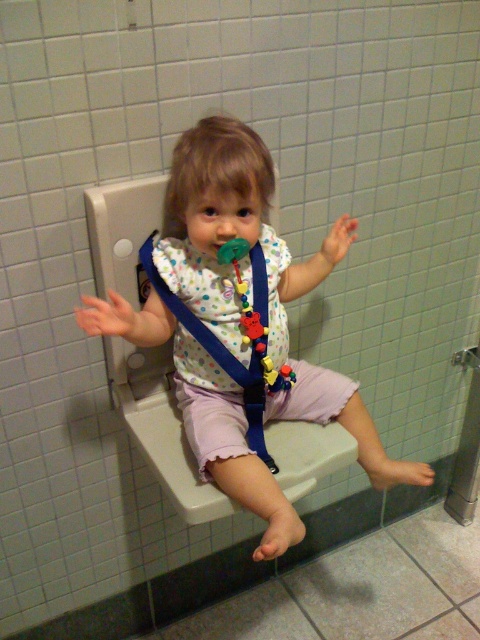
You are a parent trying to dress your child. You have a pastel polka dot shirt at center and a white dotted fabric bib at center. Which item should you put on first to ensure proper layering?

The pastel polka dot shirt at center is in front of the white dotted fabric bib at center, so you should put on the white dotted fabric bib at center first before the shirt to ensure proper layering.

You are a parent trying to dress your child. You have a pastel polka dot shirt at center and a white dotted fabric bib at center. Which clothing item should you put on first based on their sizes?

The pastel polka dot shirt at center is bigger than the white dotted fabric bib at center, so you should put on the pastel polka dot shirt at center first before the smaller bib.

Looking at the child in the image, which clothing item is positioned higher on their body between the pastel polka dot shirt at center and the white dotted fabric bib at center?

The pastel polka dot shirt at center is much taller than the white dotted fabric bib at center, so the shirt is positioned higher on the child.